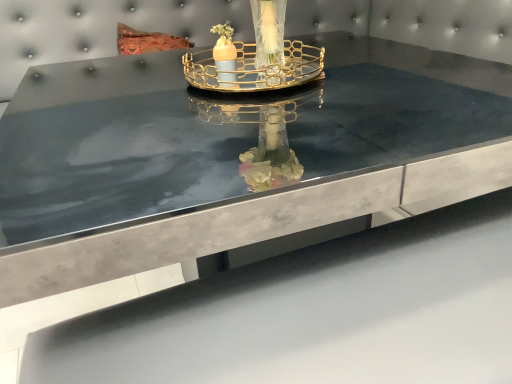
Question: Is point pyautogui.click(x=216, y=66) closer or farther from the camera than point pyautogui.click(x=302, y=54)?

Choices:
 (A) farther
 (B) closer

Answer: (B)

Question: Looking at their shapes, would you say matte orange candle at center is wider or thinner than gold metallic tray at center?

Choices:
 (A) thin
 (B) wide

Answer: (A)

Question: Is matte orange candle at center in front of or behind gold metallic tray at center in the image?

Choices:
 (A) front
 (B) behind

Answer: (B)

Question: Is gold metallic tray at center situated inside matte orange candle at center or outside?

Choices:
 (A) inside
 (B) outside

Answer: (B)

Question: From a real-world perspective, is gold metallic tray at center physically located above or below matte orange candle at center?

Choices:
 (A) above
 (B) below

Answer: (A)

Question: Considering the positions of gold metallic tray at center and matte orange candle at center in the image, is gold metallic tray at center bigger or smaller than matte orange candle at center?

Choices:
 (A) big
 (B) small

Answer: (A)

Question: Considering the positions of gold metallic tray at center and matte orange candle at center in the image, is gold metallic tray at center wider or thinner than matte orange candle at center?

Choices:
 (A) thin
 (B) wide

Answer: (B)